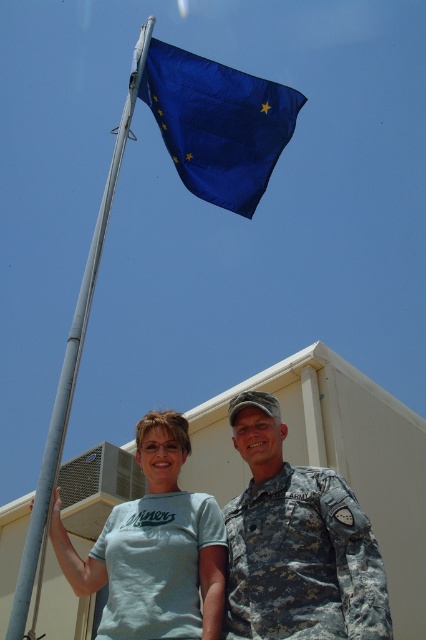
Question: Is camouflage uniform at center further to camera compared to blue fabric flag at upper center?

Choices:
 (A) no
 (B) yes

Answer: (A)

Question: Estimate the real-world distances between objects in this image. Which object is closer to the light blue t-shirt at center?

Choices:
 (A) camouflage uniform at lower center
 (B) camouflage fabric uniform at lower right
 (C) blue fabric flag at upper center

Answer: (B)

Question: Can you confirm if camouflage uniform at lower center is positioned to the right of silver metallic flag pole at left?

Choices:
 (A) no
 (B) yes

Answer: (B)

Question: Does camouflage uniform at lower center have a smaller size compared to silver metallic flag pole at left?

Choices:
 (A) yes
 (B) no

Answer: (A)

Question: Which object is closer to the camera taking this photo?

Choices:
 (A) camouflage uniform at lower center
 (B) silver metallic flag pole at left
 (C) camouflage uniform at center
 (D) camouflage fabric uniform at lower right

Answer: (B)

Question: Among these objects, which one is farthest from the camera?

Choices:
 (A) blue fabric flag at upper center
 (B) camouflage uniform at center

Answer: (A)